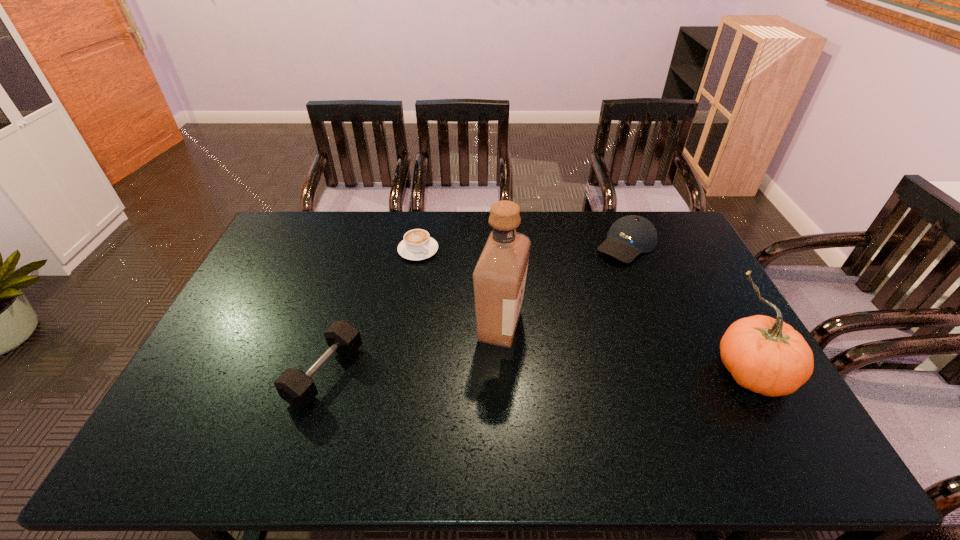
You are a GUI agent. You are given a task and a screenshot of the screen. Output one action in this format:
    pyautogui.click(x=<x>, y=<y>)
    Task: Click on the free space on the desktop that is between the dumbbell and the pumpkin and is positioned on the front-facing side of the tallest object
    This screenshot has width=960, height=540.
    Given the screenshot: What is the action you would take?
    pyautogui.click(x=560, y=373)

Locate an element on the screen. Image resolution: width=960 pixels, height=540 pixels. vacant space on the desktop that is between the dumbbell and the second tallest object and is positioned on the front-facing side of the baseball cap is located at coordinates (496, 373).

You are a GUI agent. You are given a task and a screenshot of the screen. Output one action in this format:
    pyautogui.click(x=<x>, y=<y>)
    Task: Click on the vacant space on the desktop that is between the leftmost object and the pumpkin and is positioned on the side of the fourth object from right to left with the handle
    The image size is (960, 540).
    Given the screenshot: What is the action you would take?
    pyautogui.click(x=551, y=373)